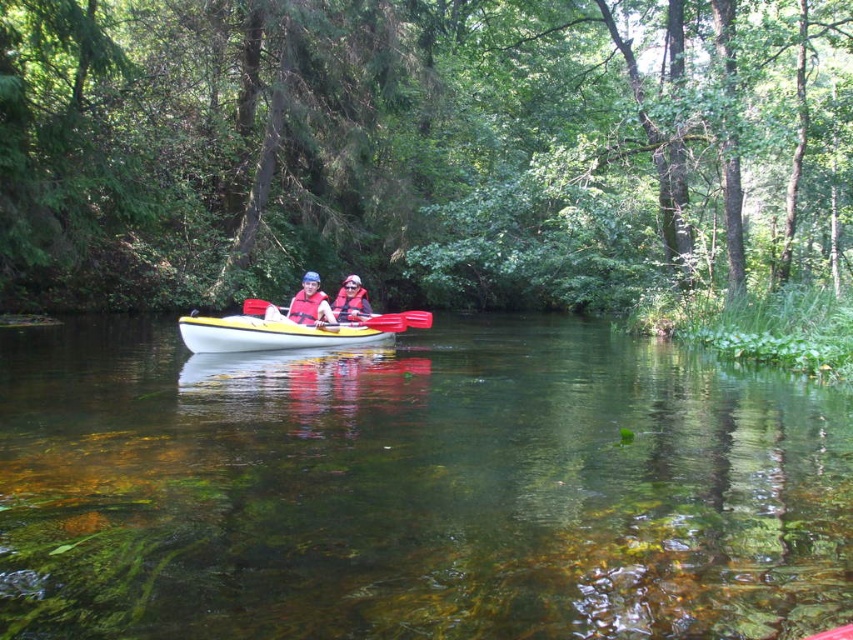
Who is shorter, yellow matte kayak at center or matte red life vest at center?

Standing shorter between the two is yellow matte kayak at center.

From the picture: Who is lower down, yellow matte kayak at center or matte red life vest at center?

yellow matte kayak at center is lower down.

Locate an element on the screen. This screenshot has width=853, height=640. yellow matte kayak at center is located at coordinates (273, 333).

Between matte blue life vest at center and yellow plastic paddle at center, which one appears on the left side from the viewer's perspective?

yellow plastic paddle at center

Image resolution: width=853 pixels, height=640 pixels. What are the coordinates of `matte blue life vest at center` in the screenshot? It's located at (310, 304).

Is clear water at center in front of yellow plastic paddle at center?

Yes, it is in front of yellow plastic paddle at center.

Does point (828, 573) lie in front of point (248, 307)?

Yes, point (828, 573) is closer to viewer.

Which is in front, point (276, 435) or point (390, 317)?

Point (276, 435) is in front.

Locate an element on the screen. This screenshot has height=640, width=853. clear water at center is located at coordinates (415, 490).